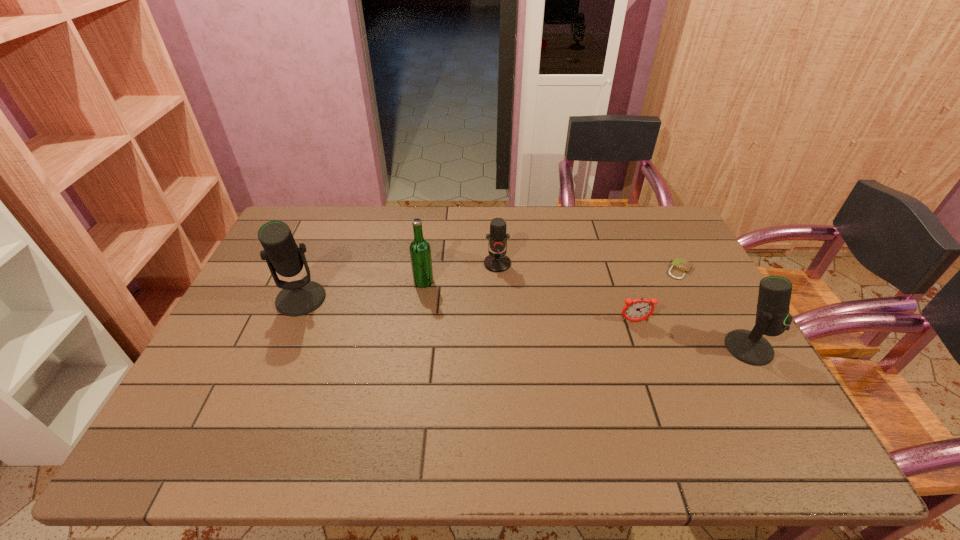
Where is `location for an additional microphone to make spacing equal`? This screenshot has height=540, width=960. location for an additional microphone to make spacing equal is located at coordinates (513, 322).